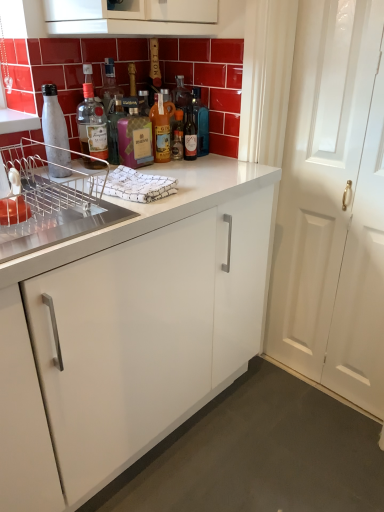
Describe the element at coordinates (190, 136) in the screenshot. I see `translucent glass bottle at center, the fifth bottle in the left-to-right sequence` at that location.

What are the coordinates of `translucent glass bottle at center, placed as the first bottle when sorted from right to left` in the screenshot? It's located at (200, 122).

What do you see at coordinates (54, 127) in the screenshot? The width and height of the screenshot is (384, 512). I see `white matte water bottle at left, which is the 6th bottle from right to left` at bounding box center [54, 127].

What do you see at coordinates (52, 201) in the screenshot? I see `metallic silver dish rack at left` at bounding box center [52, 201].

The image size is (384, 512). What do you see at coordinates (322, 188) in the screenshot?
I see `white wooden door at right` at bounding box center [322, 188].

You are a GUI agent. You are given a task and a screenshot of the screen. Output one action in this format:
    pyautogui.click(x=<x>, y=<y>)
    Task: Click on the translucent glass bottle at center, the fifth bottle in the left-to-right sequence
    
    Given the screenshot: What is the action you would take?
    pyautogui.click(x=190, y=136)

In the scene shown: Is pink glass bottle at center, the fourth bottle from the right, positioned far away from white wooden door at right?

No, pink glass bottle at center, the fourth bottle from the right, is not far from white wooden door at right.

From the image's perspective, is pink glass bottle at center, the 3th bottle positioned from the left, on white wooden door at right?

Yes.

Is white wooden door at right a part of pink glass bottle at center, the fourth bottle from the right?

No, white wooden door at right is not inside pink glass bottle at center, the fourth bottle from the right.

Which object is positioned more to the left, pink glass bottle at center, the 3th bottle positioned from the left, or matte glass bottle at upper center, which is the second bottle from left to right?

matte glass bottle at upper center, which is the second bottle from left to right.

From a real-world perspective, is pink glass bottle at center, the fourth bottle from the right, under matte glass bottle at upper center, which is the second bottle from left to right?

Yes, from a real-world perspective, pink glass bottle at center, the fourth bottle from the right, is below matte glass bottle at upper center, which is the second bottle from left to right.

Consider the image. Considering the relative sizes of pink glass bottle at center, the 3th bottle positioned from the left, and matte glass bottle at upper center, which is the fifth bottle in right-to-left order, in the image provided, is pink glass bottle at center, the 3th bottle positioned from the left, shorter than matte glass bottle at upper center, which is the fifth bottle in right-to-left order,?

Correct, pink glass bottle at center, the 3th bottle positioned from the left, is not as tall as matte glass bottle at upper center, which is the fifth bottle in right-to-left order.

Is pink glass bottle at center, the 3th bottle positioned from the left, positioned far away from matte glass bottle at upper center, which is the fifth bottle in right-to-left order?

No.

From a real-world perspective, is white wooden door at right physically located above or below matte glass bottle at upper center, which is the fifth bottle in right-to-left order?

white wooden door at right is below matte glass bottle at upper center, which is the fifth bottle in right-to-left order.

Is white wooden door at right thinner than matte glass bottle at upper center, which is the fifth bottle in right-to-left order?

Indeed, white wooden door at right has a lesser width compared to matte glass bottle at upper center, which is the fifth bottle in right-to-left order.

Is white wooden door at right to the left or to the right of matte glass bottle at upper center, which is the fifth bottle in right-to-left order, in the image?

From the image, it's evident that white wooden door at right is to the right of matte glass bottle at upper center, which is the fifth bottle in right-to-left order.

Can you confirm if white wooden door at right is taller than matte glass bottle at upper center, which is the fifth bottle in right-to-left order?

Yes, white wooden door at right is taller than matte glass bottle at upper center, which is the fifth bottle in right-to-left order.

Measure the distance between white matte water bottle at left, which is the 6th bottle from right to left, and translucent glass bottle at center, the sixth bottle from the left.

white matte water bottle at left, which is the 6th bottle from right to left, is 48.62 centimeters away from translucent glass bottle at center, the sixth bottle from the left.

Is white matte water bottle at left, which is the 6th bottle from right to left, spatially inside translucent glass bottle at center, the sixth bottle from the left, or outside of it?

white matte water bottle at left, which is the 6th bottle from right to left, is not enclosed by translucent glass bottle at center, the sixth bottle from the left.

Considering the relative sizes of white matte water bottle at left, which is the first bottle from left to right, and translucent glass bottle at center, placed as the first bottle when sorted from right to left, in the image provided, is white matte water bottle at left, which is the first bottle from left to right, wider than translucent glass bottle at center, placed as the first bottle when sorted from right to left,?

Incorrect, the width of white matte water bottle at left, which is the first bottle from left to right, does not surpass that of translucent glass bottle at center, placed as the first bottle when sorted from right to left.

Looking at this image, is white matte water bottle at left, which is the first bottle from left to right, smaller than translucent glass bottle at center, placed as the first bottle when sorted from right to left?

Indeed, white matte water bottle at left, which is the first bottle from left to right, has a smaller size compared to translucent glass bottle at center, placed as the first bottle when sorted from right to left.

Can you tell me how much white wooden door at right and translucent glass bottle at center, the sixth bottle from the left, differ in facing direction?

white wooden door at right and translucent glass bottle at center, the sixth bottle from the left, are facing 90 degrees away from each other.

Is white wooden door at right directly adjacent to translucent glass bottle at center, the sixth bottle from the left?

No, white wooden door at right is not touching translucent glass bottle at center, the sixth bottle from the left.

Considering the positions of objects white wooden door at right and translucent glass bottle at center, placed as the first bottle when sorted from right to left, in the image provided, who is more to the right, white wooden door at right or translucent glass bottle at center, placed as the first bottle when sorted from right to left,?

From the viewer's perspective, white wooden door at right appears more on the right side.

Consider the image. Is metallic silver dish rack at left next to matte glass bottle at center, the third bottle from the right, and touching it?

No, metallic silver dish rack at left is not beside matte glass bottle at center, the third bottle from the right.

Between metallic silver dish rack at left and matte glass bottle at center, the third bottle from the right, which one has smaller width?

matte glass bottle at center, the third bottle from the right.

Identify the location of the 4th bottle behind the metallic silver dish rack at left. The height and width of the screenshot is (512, 384). coord(161,128).

In the image, is metallic silver dish rack at left positioned in front of or behind matte glass bottle at center, the third bottle from the right?

Clearly, metallic silver dish rack at left is in front of matte glass bottle at center, the third bottle from the right.

The height and width of the screenshot is (512, 384). Identify the location of the 5th bottle positioned below the matte glass bottle at upper center, which is the fifth bottle in right-to-left order (from a real-world perspective). (190, 136).

Measure the distance from translucent glass bottle at center, arranged as the 2th bottle when viewed from the right, to matte glass bottle at upper center, which is the second bottle from left to right.

31.61 centimeters.

Relative to matte glass bottle at upper center, which is the second bottle from left to right, is translucent glass bottle at center, arranged as the 2th bottle when viewed from the right, in front or behind?

translucent glass bottle at center, arranged as the 2th bottle when viewed from the right, is behind matte glass bottle at upper center, which is the second bottle from left to right.

Considering the sizes of objects translucent glass bottle at center, arranged as the 2th bottle when viewed from the right, and matte glass bottle at upper center, which is the second bottle from left to right, in the image provided, who is thinner, translucent glass bottle at center, arranged as the 2th bottle when viewed from the right, or matte glass bottle at upper center, which is the second bottle from left to right,?

translucent glass bottle at center, arranged as the 2th bottle when viewed from the right, is thinner.

What are the coordinates of `door below the pink glass bottle at center, the 3th bottle positioned from the left (from a real-world perspective)` in the screenshot? It's located at (322, 188).

From the image's perspective, starting from the matte glass bottle at upper center, which is the second bottle from left to right, which bottle is the 3rd one below? Please provide its 2D coordinates.

[(134, 136)]

Based on their spatial positions, is matte glass bottle at upper center, which is the second bottle from left to right, or white matte water bottle at left, which is the 6th bottle from right to left, further from pink glass bottle at center, the fourth bottle from the right?

white matte water bottle at left, which is the 6th bottle from right to left, is further to pink glass bottle at center, the fourth bottle from the right.

Estimate the real-world distances between objects in this image. Which object is closer to metallic silver dish rack at left, matte glass bottle at center, the third bottle from the right, or translucent glass bottle at center, the fifth bottle in the left-to-right sequence?

matte glass bottle at center, the third bottle from the right, is closer to metallic silver dish rack at left.

Which object lies further to the anchor point translucent glass bottle at center, arranged as the 2th bottle when viewed from the right, white matte water bottle at left, which is the 6th bottle from right to left, or pink glass bottle at center, the 3th bottle positioned from the left?

Based on the image, white matte water bottle at left, which is the 6th bottle from right to left, appears to be further to translucent glass bottle at center, arranged as the 2th bottle when viewed from the right.

Based on the photo, considering their positions, is metallic silver dish rack at left positioned closer to translucent glass bottle at center, the fifth bottle in the left-to-right sequence, than translucent glass bottle at center, the sixth bottle from the left?

Based on the image, translucent glass bottle at center, the sixth bottle from the left, appears to be nearer to translucent glass bottle at center, the fifth bottle in the left-to-right sequence.

Which object lies further to the anchor point translucent glass bottle at center, arranged as the 2th bottle when viewed from the right, white wooden door at right or matte glass bottle at center, the third bottle from the right?

white wooden door at right lies further to translucent glass bottle at center, arranged as the 2th bottle when viewed from the right, than the other object.

Based on their spatial positions, is translucent glass bottle at center, arranged as the 2th bottle when viewed from the right, or metallic silver dish rack at left closer to matte glass bottle at center, the third bottle from the right?

translucent glass bottle at center, arranged as the 2th bottle when viewed from the right, is closer to matte glass bottle at center, the third bottle from the right.

Looking at the image, which one is located further to white wooden door at right, translucent glass bottle at center, the sixth bottle from the left, or white matte water bottle at left, which is the 6th bottle from right to left?

white matte water bottle at left, which is the 6th bottle from right to left, is further to white wooden door at right.

Estimate the real-world distances between objects in this image. Which object is further from translucent glass bottle at center, the sixth bottle from the left, metallic silver dish rack at left or matte glass bottle at upper center, which is the fifth bottle in right-to-left order?

metallic silver dish rack at left is positioned further to the anchor translucent glass bottle at center, the sixth bottle from the left.

Where is `bottle located between matte glass bottle at center, which is the fourth bottle from left to right, and translucent glass bottle at center, the sixth bottle from the left, in the left-right direction`? This screenshot has width=384, height=512. bottle located between matte glass bottle at center, which is the fourth bottle from left to right, and translucent glass bottle at center, the sixth bottle from the left, in the left-right direction is located at coordinates (190, 136).

Identify the location of bottle between metallic silver dish rack at left and pink glass bottle at center, the fourth bottle from the right, from front to back. point(54,127).

In order to click on bottle between matte glass bottle at upper center, which is the second bottle from left to right, and matte glass bottle at center, the third bottle from the right, from left to right in this screenshot , I will do `click(134, 136)`.

Locate an element on the screen. The width and height of the screenshot is (384, 512). bottle between pink glass bottle at center, the fourth bottle from the right, and translucent glass bottle at center, the fifth bottle in the left-to-right sequence is located at coordinates (161, 128).